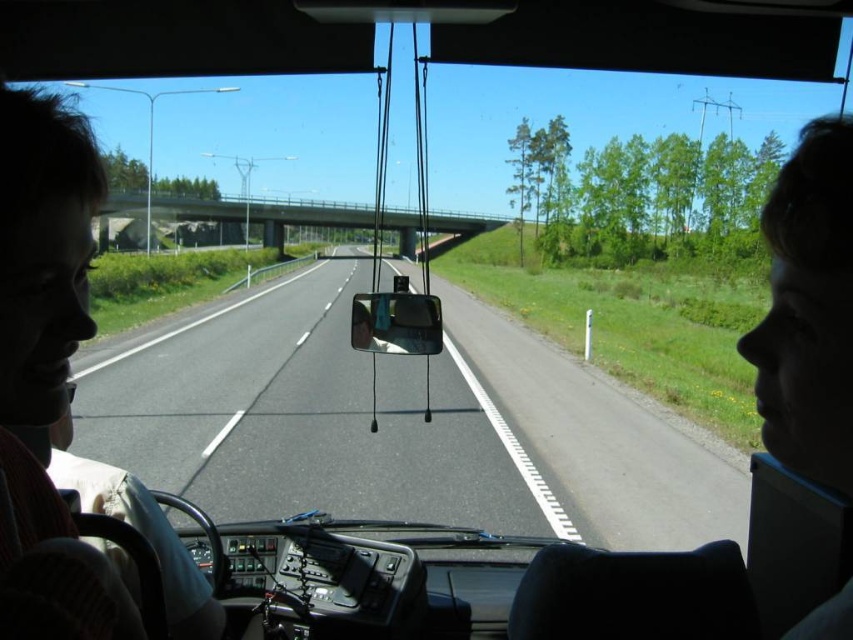
Can you confirm if asphalt road at center is positioned above clear glass view mirror at center?

No.

At what (x,y) coordinates should I click in order to perform the action: click on asphalt road at center. Please return your answer as a coordinate pair (x, y). Looking at the image, I should click on (306, 419).

Which is behind, point (90, 376) or point (421, 339)?

The point (90, 376) is behind.

The width and height of the screenshot is (853, 640). Find the location of `asphalt road at center`. asphalt road at center is located at coordinates (306, 419).

Who is more forward, (x=264, y=412) or (x=361, y=332)?

Point (x=361, y=332)

Which is more to the right, asphalt road at center or matte white face at center?

matte white face at center is more to the right.

This screenshot has width=853, height=640. I want to click on asphalt road at center, so click(306, 419).

What are the coordinates of `asphalt road at center` in the screenshot? It's located at [306, 419].

Between clear glass view mirror at center and matte white face at center, which one has less height?

Standing shorter between the two is matte white face at center.

Who is more forward, (386, 296) or (378, 300)?

Point (378, 300) is in front.

I want to click on clear glass view mirror at center, so click(x=396, y=323).